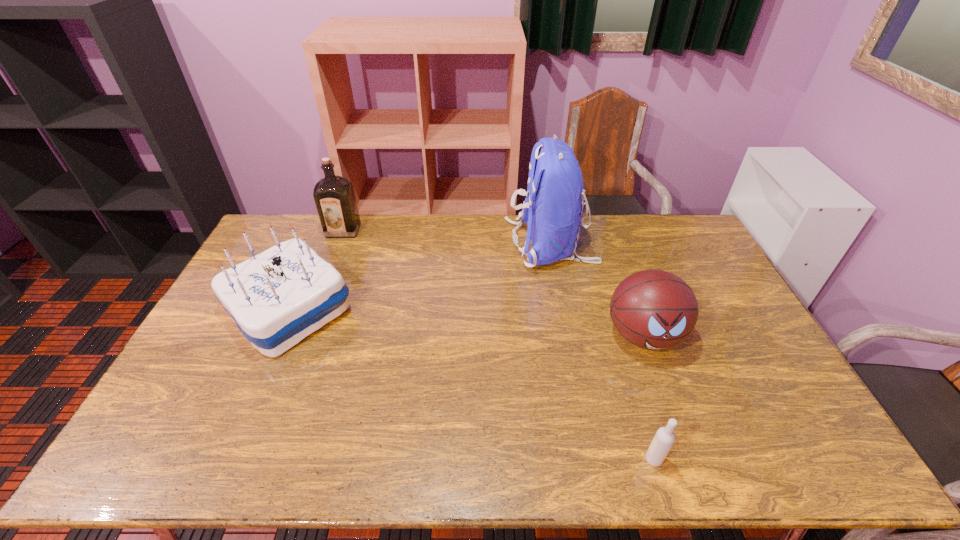
Locate which object ranks in proximity to the tallest object. Please provide its 2D coordinates. Your answer should be formatted as a tuple, i.e. [(x, y)], where the tuple contains the x and y coordinates of a point satisfying the conditions above.

[(654, 309)]

Point out which object is positioned as the third nearest to the backpack. Please provide its 2D coordinates. Your answer should be formatted as a tuple, i.e. [(x, y)], where the tuple contains the x and y coordinates of a point satisfying the conditions above.

[(334, 196)]

This screenshot has width=960, height=540. I want to click on free space that satisfies the following two spatial constraints: 1. on the label of the nearest object; 2. on the left side of the liquor, so click(254, 460).

Image resolution: width=960 pixels, height=540 pixels. Identify the location of free space that satisfies the following two spatial constraints: 1. on the back of the vodka; 2. on the right side of the backpack. (592, 460).

Locate an element on the screen. The image size is (960, 540). free location that satisfies the following two spatial constraints: 1. on the back of the basketball; 2. on the left side of the tallest object is located at coordinates (568, 335).

Where is `blank area in the image that satisfies the following two spatial constraints: 1. on the back of the fourth tallest object; 2. on the right side of the tallest object`? The image size is (960, 540). blank area in the image that satisfies the following two spatial constraints: 1. on the back of the fourth tallest object; 2. on the right side of the tallest object is located at coordinates (568, 335).

Locate an element on the screen. The height and width of the screenshot is (540, 960). blank space that satisfies the following two spatial constraints: 1. on the back of the tallest object; 2. on the front side of the birthday cake is located at coordinates (564, 309).